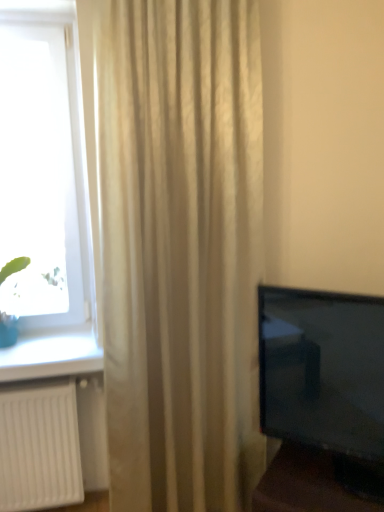
What is the approximate height of beige textured curtain at center?

The height of beige textured curtain at center is 2.34 meters.

You are a GUI agent. You are given a task and a screenshot of the screen. Output one action in this format:
    pyautogui.click(x=<x>, y=<y>)
    Task: Click on the transparent glass window at left
    
    Given the screenshot: What is the action you would take?
    pyautogui.click(x=65, y=161)

How much distance is there between green leafy plant at left and transparent glass window at left?

green leafy plant at left is 17.81 inches from transparent glass window at left.

From the image's perspective, is green leafy plant at left over transparent glass window at left?

Actually, green leafy plant at left appears below transparent glass window at left in the image.

Can transparent glass window at left be found inside green leafy plant at left?

No, transparent glass window at left is located outside of green leafy plant at left.

Is green leafy plant at left at the back of beige textured curtain at center?

beige textured curtain at center is not turned away from green leafy plant at left.

Considering the points (194, 67) and (7, 317), which point is in front, point (194, 67) or point (7, 317)?

The point (194, 67) is in front.

Is beige textured curtain at center in front of or behind green leafy plant at left in the image?

beige textured curtain at center is positioned closer to the viewer than green leafy plant at left.

Is beige textured curtain at center wider or thinner than green leafy plant at left?

Clearly, beige textured curtain at center has more width compared to green leafy plant at left.

Is transparent glass window at left bigger than beige textured curtain at center?

Actually, transparent glass window at left might be smaller than beige textured curtain at center.

Is transparent glass window at left not close to beige textured curtain at center?

They are positioned close to each other.

Does transparent glass window at left turn towards beige textured curtain at center?

No, transparent glass window at left is not turned towards beige textured curtain at center.

From a real-world perspective, is beige textured curtain at center physically above transparent glass window at left?

No, from a real-world perspective, beige textured curtain at center is not above transparent glass window at left.

Considering the sizes of beige textured curtain at center and transparent glass window at left in the image, is beige textured curtain at center taller or shorter than transparent glass window at left?

Clearly, beige textured curtain at center is taller compared to transparent glass window at left.

Does beige textured curtain at center touch transparent glass window at left?

beige textured curtain at center and transparent glass window at left are not in contact.

Is beige textured curtain at center oriented away from transparent glass window at left?

No.

Is transparent glass window at left oriented towards green leafy plant at left?

Yes, transparent glass window at left is oriented towards green leafy plant at left.

Is transparent glass window at left in contact with green leafy plant at left?

No, transparent glass window at left is not next to green leafy plant at left.

In the scene shown: Considering the sizes of objects transparent glass window at left and green leafy plant at left in the image provided, who is shorter, transparent glass window at left or green leafy plant at left?

With less height is green leafy plant at left.

Would you say green leafy plant at left is inside or outside beige textured curtain at center?

green leafy plant at left is not inside beige textured curtain at center, it's outside.

Who is smaller, green leafy plant at left or beige textured curtain at center?

green leafy plant at left.

Which object is further away from the camera taking this photo, green leafy plant at left or beige textured curtain at center?

green leafy plant at left is further away from the camera.

From the picture: In the image, is green leafy plant at left on the left side or the right side of beige textured curtain at center?

Based on their positions, green leafy plant at left is located to the left of beige textured curtain at center.

Identify the location of plant on the left of transparent glass window at left. (8, 330).

What are the coordinates of `curtain that is in front of the green leafy plant at left` in the screenshot? It's located at click(x=180, y=250).

Based on their spatial positions, is transparent glass window at left or beige textured curtain at center further from green leafy plant at left?

beige textured curtain at center is positioned further to the anchor green leafy plant at left.

Based on their spatial positions, is beige textured curtain at center or transparent glass window at left further from green leafy plant at left?

beige textured curtain at center lies further to green leafy plant at left than the other object.

In the scene shown: Looking at the image, which one is located closer to beige textured curtain at center, transparent glass window at left or green leafy plant at left?

transparent glass window at left is closer to beige textured curtain at center.

Estimate the real-world distances between objects in this image. Which object is further from beige textured curtain at center, green leafy plant at left or transparent glass window at left?

Among the two, green leafy plant at left is located further to beige textured curtain at center.

From the image, which object appears to be farther from transparent glass window at left, green leafy plant at left or beige textured curtain at center?

green leafy plant at left.

Estimate the real-world distances between objects in this image. Which object is closer to transparent glass window at left, beige textured curtain at center or green leafy plant at left?

beige textured curtain at center lies closer to transparent glass window at left than the other object.

You are a GUI agent. You are given a task and a screenshot of the screen. Output one action in this format:
    pyautogui.click(x=<x>, y=<y>)
    Task: Click on the window between green leafy plant at left and beige textured curtain at center in the horizontal direction
    This screenshot has height=512, width=384.
    Given the screenshot: What is the action you would take?
    pyautogui.click(x=65, y=161)